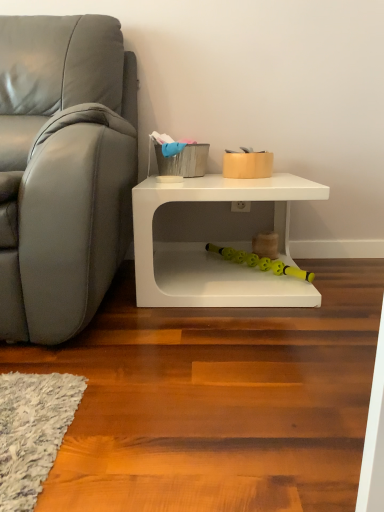
Describe the element at coordinates (259, 262) in the screenshot. I see `yellow rubber toy at lower center, positioned as the 1th toy in bottom-to-top order` at that location.

You are a GUI agent. You are given a task and a screenshot of the screen. Output one action in this format:
    pyautogui.click(x=<x>, y=<y>)
    Task: Click on the yellow rubber toy at lower center, marked as the 2th toy in a top-to-bottom arrangement
    
    Given the screenshot: What is the action you would take?
    pyautogui.click(x=259, y=262)

Image resolution: width=384 pixels, height=512 pixels. What do you see at coordinates (63, 170) in the screenshot?
I see `matte gray couch at left` at bounding box center [63, 170].

The height and width of the screenshot is (512, 384). I want to click on white matte table at lower right, so click(x=209, y=241).

What are the coordinates of `yellow rubber toy at lower center, positioned as the 1th toy in bottom-to-top order` in the screenshot? It's located at (259, 262).

Find the location of a particular element. This screenshot has width=384, height=512. the 2nd toy counting from the right side of the matte gray couch at left is located at coordinates (259, 262).

Measure the distance from matte gray couch at left to yellow rubber toy at lower center, positioned as the 1th toy in bottom-to-top order.

matte gray couch at left is 69.72 centimeters from yellow rubber toy at lower center, positioned as the 1th toy in bottom-to-top order.

Are matte gray couch at left and yellow rubber toy at lower center, positioned as the 1th toy in bottom-to-top order, located far from each other?

That's not correct — matte gray couch at left is a little close to yellow rubber toy at lower center, positioned as the 1th toy in bottom-to-top order.

From the image's perspective, which one is positioned lower, matte gray couch at left or yellow rubber toy at lower center, positioned as the 1th toy in bottom-to-top order?

yellow rubber toy at lower center, positioned as the 1th toy in bottom-to-top order, from the image's perspective.

From a real-world perspective, which object rests below the other?

white matte table at lower right.

Would you say white matte table at lower right is part of matte gold container at center, the second toy when ordered from bottom to top,'s contents?

No, white matte table at lower right is not a part of matte gold container at center, the second toy when ordered from bottom to top.

Which object is closer to the camera taking this photo, matte gold container at center, which is the 1th toy from top to bottom, or white matte table at lower right?

white matte table at lower right.

Is matte gold container at center, the second toy when ordered from bottom to top, touching white matte table at lower right?

matte gold container at center, the second toy when ordered from bottom to top, and white matte table at lower right are not in contact.

How many degrees apart are the facing directions of yellow rubber toy at lower center, positioned as the 1th toy in bottom-to-top order, and matte gray couch at left?

2.34e-05 degrees separate the facing orientations of yellow rubber toy at lower center, positioned as the 1th toy in bottom-to-top order, and matte gray couch at left.

Is point (279, 273) farther from viewer compared to point (80, 302)?

Yes, it is.

From the image's perspective, is yellow rubber toy at lower center, positioned as the 1th toy in bottom-to-top order, above or below matte gray couch at left?

Based on their image positions, yellow rubber toy at lower center, positioned as the 1th toy in bottom-to-top order, is located beneath matte gray couch at left.

Which of these two, yellow rubber toy at lower center, positioned as the 1th toy in bottom-to-top order, or matte gray couch at left, is wider?

matte gray couch at left is wider.

Locate an element on the screen. This screenshot has width=384, height=512. studio couch in front of the white matte table at lower right is located at coordinates [63, 170].

Which is more to the right, matte gray couch at left or white matte table at lower right?

From the viewer's perspective, white matte table at lower right appears more on the right side.

Does matte gray couch at left come in front of white matte table at lower right?

Yes, the depth of matte gray couch at left is less than that of white matte table at lower right.

Considering the relative sizes of white matte table at lower right and matte gray couch at left in the image provided, is white matte table at lower right taller than matte gray couch at left?

Incorrect, the height of white matte table at lower right is not larger of that of matte gray couch at left.

Considering the sizes of objects white matte table at lower right and matte gray couch at left in the image provided, who is smaller, white matte table at lower right or matte gray couch at left?

With smaller size is white matte table at lower right.

From the picture: From a real-world perspective, is white matte table at lower right positioned under matte gray couch at left based on gravity?

Yes, from a real-world perspective, white matte table at lower right is beneath matte gray couch at left.

From the image's perspective, is white matte table at lower right under matte gray couch at left?

Indeed, from the image's perspective, white matte table at lower right is shown beneath matte gray couch at left.

From the image's perspective, does yellow rubber toy at lower center, positioned as the 1th toy in bottom-to-top order, appear higher than white matte table at lower right?

Incorrect, from the image's perspective, yellow rubber toy at lower center, positioned as the 1th toy in bottom-to-top order, is lower than white matte table at lower right.

Would you say yellow rubber toy at lower center, marked as the 2th toy in a top-to-bottom arrangement, contains white matte table at lower right?

No, white matte table at lower right is located outside of yellow rubber toy at lower center, marked as the 2th toy in a top-to-bottom arrangement.

Based on the photo, could you tell me if yellow rubber toy at lower center, positioned as the 1th toy in bottom-to-top order, is turned towards white matte table at lower right?

Yes, yellow rubber toy at lower center, positioned as the 1th toy in bottom-to-top order, is oriented towards white matte table at lower right.

How many degrees apart are the facing directions of yellow rubber toy at lower center, positioned as the 1th toy in bottom-to-top order, and white matte table at lower right?

The angular difference between yellow rubber toy at lower center, positioned as the 1th toy in bottom-to-top order, and white matte table at lower right is 0.000136 degrees.

Is yellow rubber toy at lower center, marked as the 2th toy in a top-to-bottom arrangement, smaller than matte gold container at center, which is the 1th toy from top to bottom?

Correct, yellow rubber toy at lower center, marked as the 2th toy in a top-to-bottom arrangement, occupies less space than matte gold container at center, which is the 1th toy from top to bottom.

Is yellow rubber toy at lower center, marked as the 2th toy in a top-to-bottom arrangement, taller than matte gold container at center, which is the 1th toy from top to bottom?

In fact, yellow rubber toy at lower center, marked as the 2th toy in a top-to-bottom arrangement, may be shorter than matte gold container at center, which is the 1th toy from top to bottom.

Based on the photo, could you measure the distance between yellow rubber toy at lower center, positioned as the 1th toy in bottom-to-top order, and matte gold container at center, the second toy when ordered from bottom to top?

They are 36.08 centimeters apart.

Does point (306, 277) lie in front of point (265, 164)?

No.

I want to click on studio couch located above the yellow rubber toy at lower center, marked as the 2th toy in a top-to-bottom arrangement (from the image's perspective), so click(63, 170).

This screenshot has width=384, height=512. What are the coordinates of `table below the matte gold container at center, the second toy when ordered from bottom to top (from a real-world perspective)` in the screenshot? It's located at (209, 241).

When comparing their distances from matte gray couch at left, does matte gold container at center, the second toy when ordered from bottom to top, or white matte table at lower right seem closer?

white matte table at lower right is positioned closer to the anchor matte gray couch at left.

Looking at the image, which one is located closer to white matte table at lower right, yellow rubber toy at lower center, marked as the 2th toy in a top-to-bottom arrangement, or matte gold container at center, which is the 1th toy from top to bottom?

yellow rubber toy at lower center, marked as the 2th toy in a top-to-bottom arrangement.

Estimate the real-world distances between objects in this image. Which object is closer to matte gray couch at left, white matte table at lower right or matte gold container at center, the second toy when ordered from bottom to top?

white matte table at lower right is positioned closer to the anchor matte gray couch at left.

Considering their positions, is matte gray couch at left positioned closer to yellow rubber toy at lower center, marked as the 2th toy in a top-to-bottom arrangement, than white matte table at lower right?

white matte table at lower right lies closer to yellow rubber toy at lower center, marked as the 2th toy in a top-to-bottom arrangement, than the other object.

From the image, which object appears to be nearer to yellow rubber toy at lower center, marked as the 2th toy in a top-to-bottom arrangement, matte gold container at center, which is the 1th toy from top to bottom, or matte gray couch at left?

matte gold container at center, which is the 1th toy from top to bottom, is positioned closer to the anchor yellow rubber toy at lower center, marked as the 2th toy in a top-to-bottom arrangement.

From the image, which object appears to be nearer to matte gold container at center, the second toy when ordered from bottom to top, matte gray couch at left or yellow rubber toy at lower center, positioned as the 1th toy in bottom-to-top order?

yellow rubber toy at lower center, positioned as the 1th toy in bottom-to-top order, is closer to matte gold container at center, the second toy when ordered from bottom to top.

Based on their spatial positions, is matte gray couch at left or matte gold container at center, the second toy when ordered from bottom to top, further from white matte table at lower right?

matte gray couch at left is further to white matte table at lower right.

Considering their positions, is yellow rubber toy at lower center, positioned as the 1th toy in bottom-to-top order, positioned closer to matte gray couch at left than white matte table at lower right?

Among the two, white matte table at lower right is located nearer to matte gray couch at left.

The width and height of the screenshot is (384, 512). Identify the location of toy located between matte gray couch at left and yellow rubber toy at lower center, marked as the 2th toy in a top-to-bottom arrangement, in the left-right direction. (247, 165).

This screenshot has width=384, height=512. Find the location of `table between matte gray couch at left and matte gold container at center, which is the 1th toy from top to bottom, in the horizontal direction`. table between matte gray couch at left and matte gold container at center, which is the 1th toy from top to bottom, in the horizontal direction is located at coordinates (209, 241).

Find the location of a particular element. The height and width of the screenshot is (512, 384). table between matte gray couch at left and yellow rubber toy at lower center, positioned as the 1th toy in bottom-to-top order, from left to right is located at coordinates (209, 241).

The width and height of the screenshot is (384, 512). Identify the location of table between matte gold container at center, which is the 1th toy from top to bottom, and yellow rubber toy at lower center, marked as the 2th toy in a top-to-bottom arrangement, in the vertical direction. (209, 241).